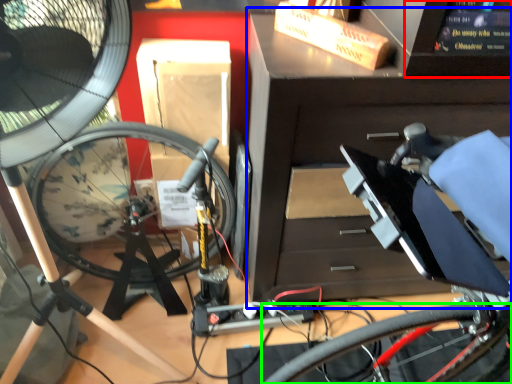
Question: Which object is the closest to the computer screen (highlighted by a red box)? Choose among these: workbench (highlighted by a blue box) or bicycle wheel (highlighted by a green box).

Choices:
 (A) workbench
 (B) bicycle wheel

Answer: (A)